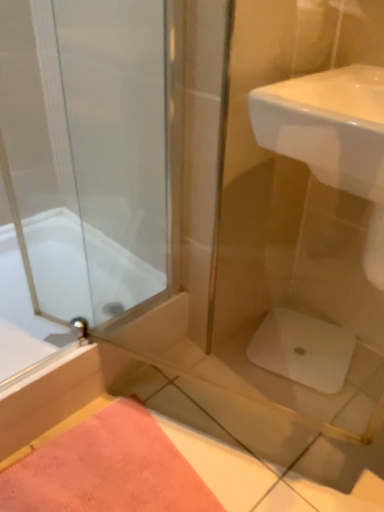
Question: Does white glossy sink at upper right have a lesser height compared to white glossy bathtub at left?

Choices:
 (A) no
 (B) yes

Answer: (A)

Question: Is white glossy sink at upper right to the right of white glossy bathtub at left from the viewer's perspective?

Choices:
 (A) no
 (B) yes

Answer: (B)

Question: Is white glossy sink at upper right located outside white glossy bathtub at left?

Choices:
 (A) no
 (B) yes

Answer: (B)

Question: From a real-world perspective, is white glossy sink at upper right on white glossy bathtub at left?

Choices:
 (A) no
 (B) yes

Answer: (B)

Question: Is white glossy sink at upper right smaller than white glossy bathtub at left?

Choices:
 (A) yes
 (B) no

Answer: (A)

Question: From the image's perspective, is white glossy sink at upper right on top of white glossy bathtub at left?

Choices:
 (A) no
 (B) yes

Answer: (B)

Question: Is white glossy bathtub at left positioned beyond the bounds of pink fabric bath mat at lower left?

Choices:
 (A) no
 (B) yes

Answer: (B)

Question: Is white glossy bathtub at left oriented away from pink fabric bath mat at lower left?

Choices:
 (A) yes
 (B) no

Answer: (B)

Question: Does white glossy bathtub at left contain pink fabric bath mat at lower left?

Choices:
 (A) yes
 (B) no

Answer: (B)

Question: Would you consider white glossy bathtub at left to be distant from pink fabric bath mat at lower left?

Choices:
 (A) yes
 (B) no

Answer: (B)

Question: Considering the relative sizes of white glossy bathtub at left and pink fabric bath mat at lower left in the image provided, is white glossy bathtub at left smaller than pink fabric bath mat at lower left?

Choices:
 (A) no
 (B) yes

Answer: (A)

Question: Does white glossy bathtub at left come in front of pink fabric bath mat at lower left?

Choices:
 (A) no
 (B) yes

Answer: (A)

Question: Is white glossy sink at upper right far away from pink fabric bath mat at lower left?

Choices:
 (A) yes
 (B) no

Answer: (B)